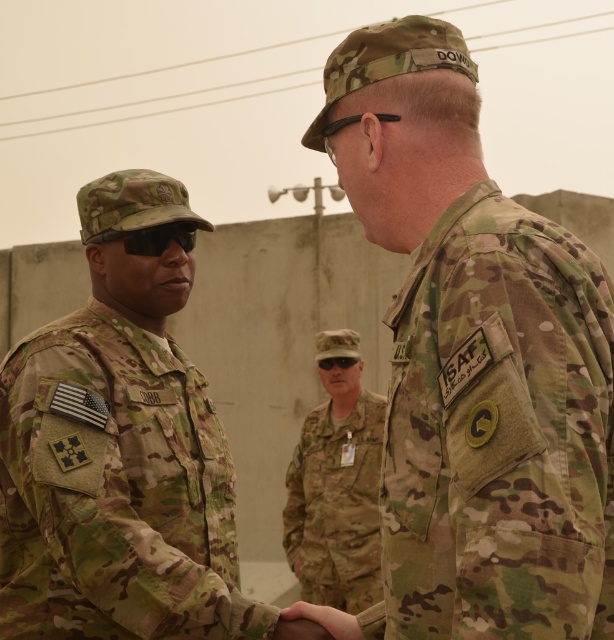
You are a drone operator controlling a drone that is 0.1 meters above the ground. You need to capture a closeup of both point (87, 368) and point (338, 356). Which point should you focus on first to ensure the closest distance for the closeup?

Point (87, 368) is closer to the camera than point (338, 356), so you should focus on point (87, 368) first to ensure the closest distance for the closeup.